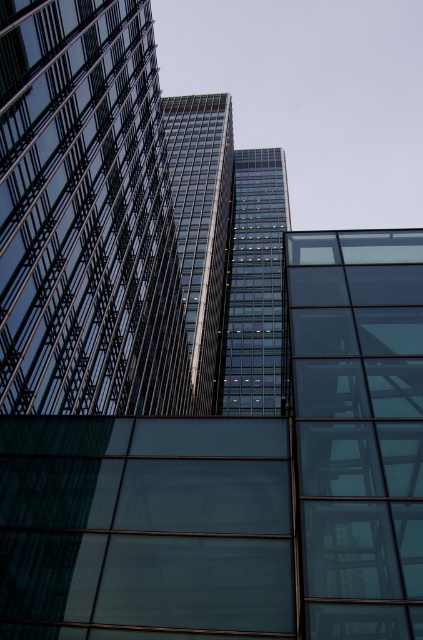
You are an architect reviewing a cityscape design. You notice two central structures, the transparent glass building at center and the glassy reflective tower at center. Based on their positioning, which one is located to the left when viewed from your perspective?

The transparent glass building at center is positioned on the left side of the glassy reflective tower at center, so it is located to the left when viewed from your perspective.

You are a drone operator who needs to fly a drone between the transparent glass building at center and the glassy steel tower at center. The drone has a wingspan of 3 meters. Based on the scene, can the drone safely navigate through the space between them?

The distance between the transparent glass building at center and the glassy steel tower at center is 35.93 meters. Since the drone has a wingspan of 3 meters, it can safely navigate through the space between them as the distance is more than sufficient for the drone to pass without any issues.

You are an architect reviewing the blueprints of a cityscape. You notice two towers in the design, the glassy reflective tower at center and the glassy steel tower at center. According to the blueprints, which tower is positioned lower in the design?

The glassy reflective tower at center is positioned lower than the glassy steel tower at center according to the blueprints.